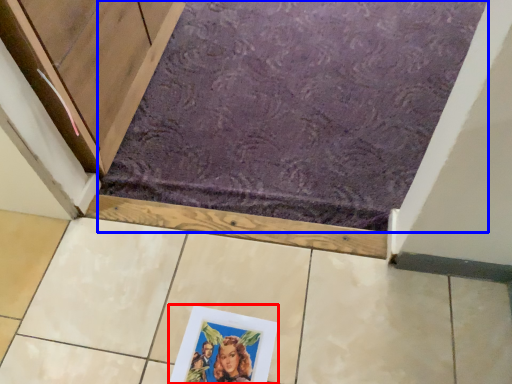
Question: Which object is further to the camera taking this photo, picture frame (highlighted by a red box) or bath mat (highlighted by a blue box)?

Choices:
 (A) picture frame
 (B) bath mat

Answer: (B)